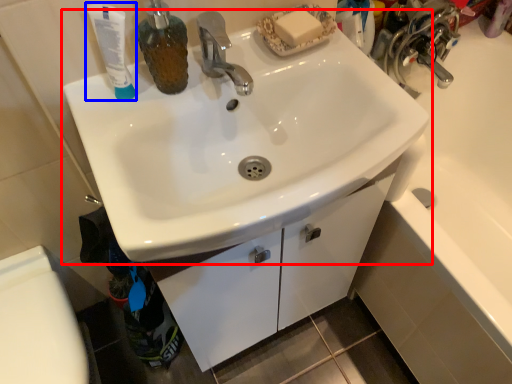
Question: Which of the following is the farthest to the observer, sink (highlighted by a red box) or toothpaste (highlighted by a blue box)?

Choices:
 (A) sink
 (B) toothpaste

Answer: (B)